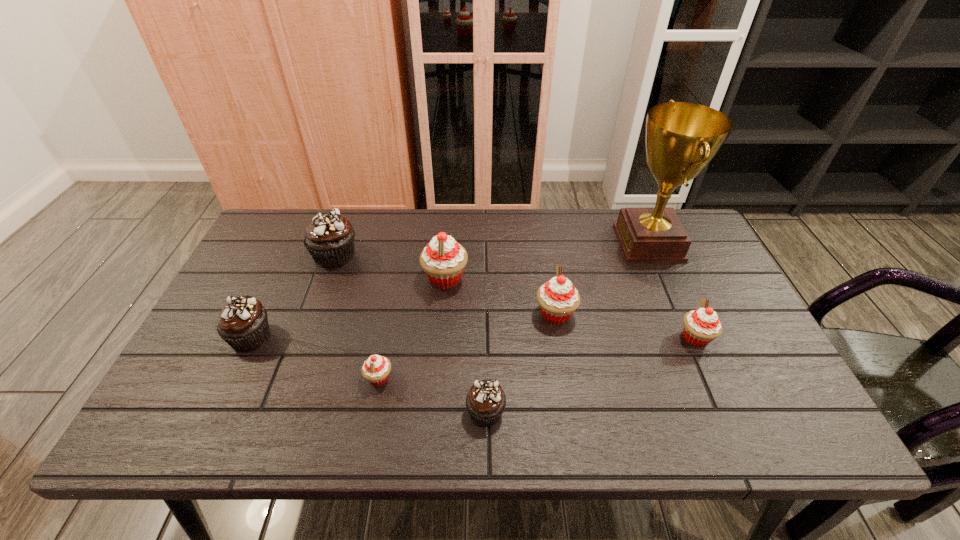
The width and height of the screenshot is (960, 540). I want to click on vacant space positioned 0.390m on the right of the biggest brown cupcake, so click(488, 255).

Identify the location of free space located 0.140m on the left of the second pink cupcake from right to left. The width and height of the screenshot is (960, 540). (482, 314).

This screenshot has width=960, height=540. I want to click on free space located on the front of the rightmost cupcake, so click(x=736, y=429).

Identify the location of vacant space located on the back of the second nearest brown cupcake. (274, 289).

What are the coordinates of `free space located on the back of the nearest pink cupcake` in the screenshot? It's located at (401, 261).

I want to click on vacant space located on the back of the rightmost brown cupcake, so click(485, 305).

Where is `award at the far edge`? award at the far edge is located at coordinates (681, 138).

At what (x,y) coordinates should I click in order to perform the action: click on cupcake situated at the far edge. Please return your answer as a coordinate pair (x, y). The width and height of the screenshot is (960, 540). Looking at the image, I should click on (329, 238).

Locate an element on the screen. The height and width of the screenshot is (540, 960). object that is at the near edge is located at coordinates (485, 402).

At what (x,y) coordinates should I click in order to perform the action: click on object that is at the left edge. Please return your answer as a coordinate pair (x, y). The image size is (960, 540). Looking at the image, I should click on (243, 324).